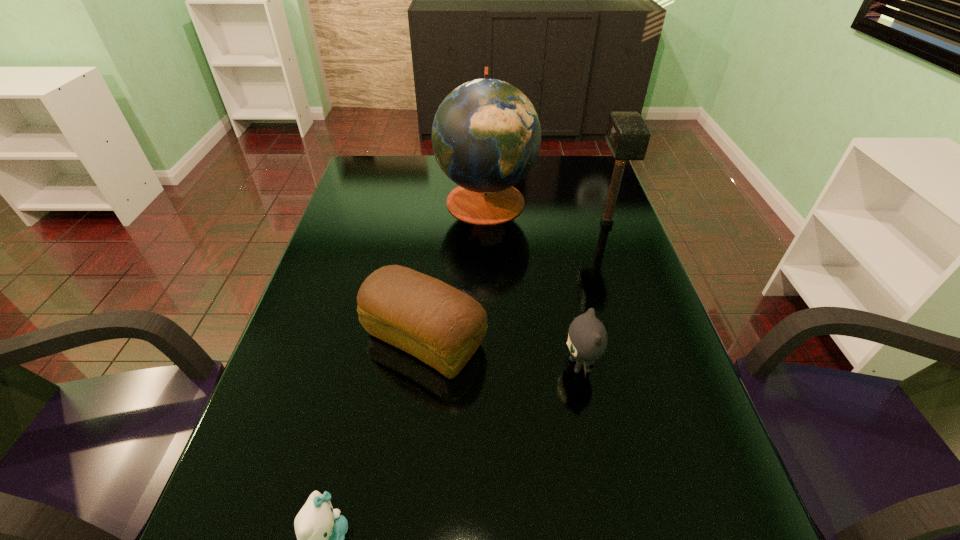
The width and height of the screenshot is (960, 540). In order to click on vacant area that lies between the right kitten and the tallest object in this screenshot , I will do coord(533,282).

Locate an element on the screen. The width and height of the screenshot is (960, 540). free space between the tallest object and the taller kitten is located at coordinates coord(533,282).

Identify the location of vacant space that is in between the globe and the fourth tallest object. This screenshot has height=540, width=960. (533, 282).

Where is `vacant space in between the third tallest object and the rightmost object`? This screenshot has height=540, width=960. vacant space in between the third tallest object and the rightmost object is located at coordinates (516, 281).

Locate an element on the screen. This screenshot has height=540, width=960. vacant area between the bread and the taller kitten is located at coordinates (502, 352).

Where is `free space between the third tallest object and the globe`? This screenshot has height=540, width=960. free space between the third tallest object and the globe is located at coordinates (455, 269).

Find the location of a particular element. Image resolution: width=960 pixels, height=540 pixels. vacant area between the third tallest object and the taller kitten is located at coordinates click(502, 352).

What are the coordinates of `free point between the third tallest object and the fourth shortest object` in the screenshot? It's located at (516, 281).

You are a GUI agent. You are given a task and a screenshot of the screen. Output one action in this format:
    pyautogui.click(x=<x>, y=<y>)
    Task: Click on the third closest object to the globe
    
    Given the screenshot: What is the action you would take?
    pyautogui.click(x=587, y=339)

Find the location of a particular element. object that is the fourth closest to the tallest object is located at coordinates (320, 530).